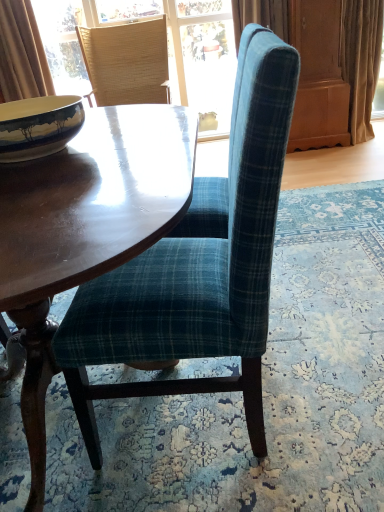
This screenshot has height=512, width=384. Identify the location of free space in front of beige fabric curtain at right, positioned as the second curtain in left-to-right order. [x=361, y=152].